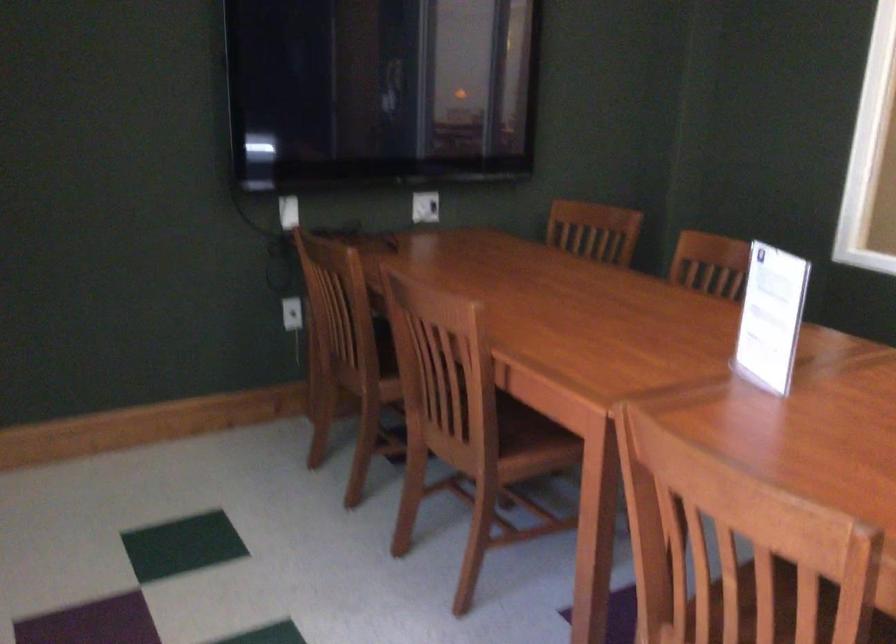
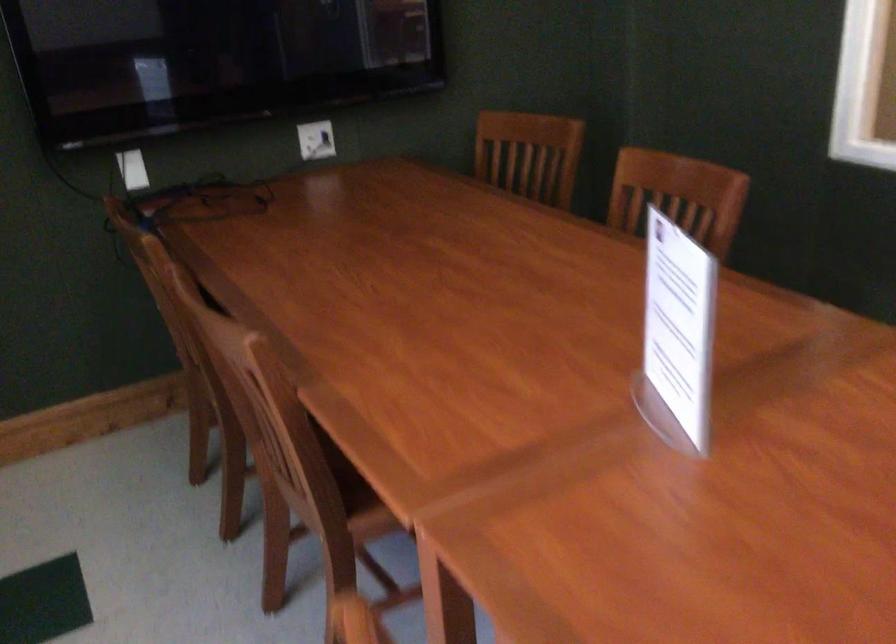
The point at (771, 319) is marked in the first image. Where is the corresponding point in the second image?

(677, 335)